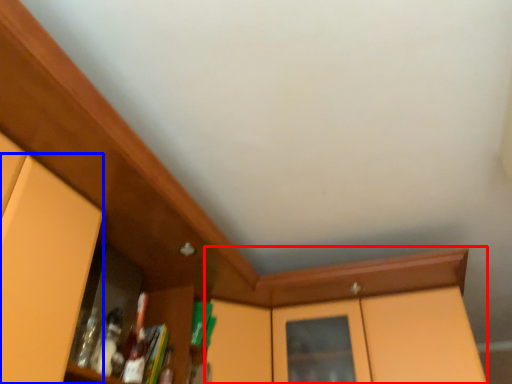
Question: Among these objects, which one is farthest to the camera, cabinetry (highlighted by a red box) or door (highlighted by a blue box)?

Choices:
 (A) cabinetry
 (B) door

Answer: (A)